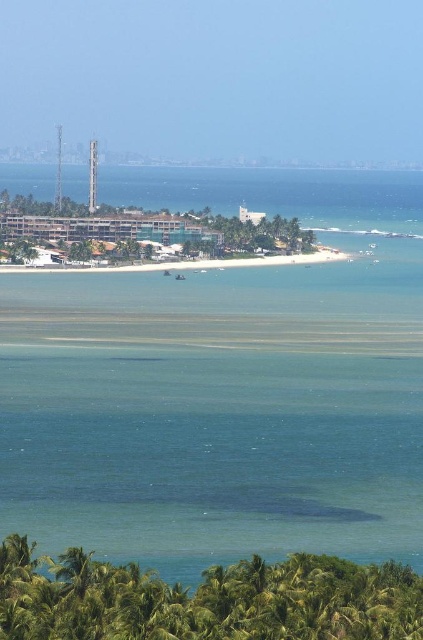
Is clear blue water at center further to camera compared to green leafy palm tree at lower left?

Yes, clear blue water at center is behind green leafy palm tree at lower left.

What do you see at coordinates (225, 385) in the screenshot? This screenshot has width=423, height=640. I see `clear blue water at center` at bounding box center [225, 385].

Identify the location of clear blue water at center. The height and width of the screenshot is (640, 423). (225, 385).

Who is lower down, clear blue water at center or white sand beach at center?

clear blue water at center

Who is more forward, (382, 428) or (93, 268)?

Point (93, 268) is in front.

The width and height of the screenshot is (423, 640). Find the location of `clear blue water at center`. clear blue water at center is located at coordinates (225, 385).

Is green leafy palm tree at lower left above white sand beach at center?

Actually, green leafy palm tree at lower left is below white sand beach at center.

Does green leafy palm tree at lower left come behind white sand beach at center?

No, it is not.

Between point (175, 627) and point (142, 266), which one is positioned in front?

Point (175, 627)

At what (x,y) coordinates should I click in order to perform the action: click on green leafy palm tree at lower left. Please return your answer as a coordinate pair (x, y). The height and width of the screenshot is (640, 423). Looking at the image, I should click on (205, 600).